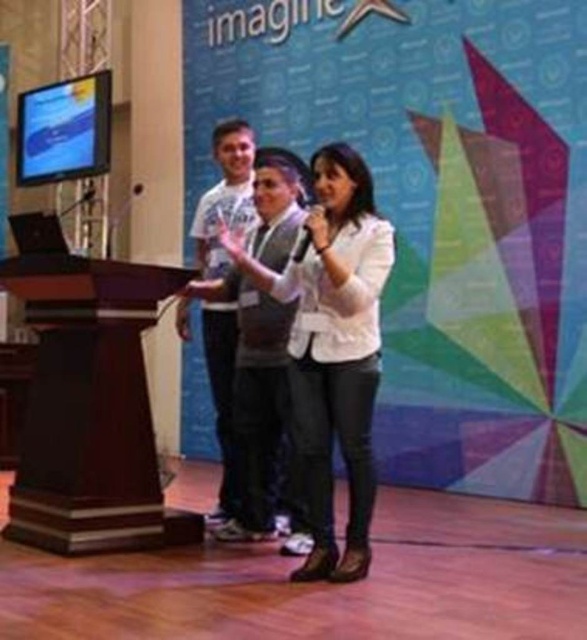
You are standing on the stage and want to move from the point at [106,371] to the point at [342,388]. Is the destination point in front of or behind you?

The point at [342,388] is in front of you because the point at [106,371] is behind it.

You are organizing a presentation and need to place a large banner between the dark wood podium at left and the white matte jacket at center. Which object should the banner be placed closer to if it needs to be near the smaller object?

The banner should be placed closer to the dark wood podium at left because it is smaller in size compared to the white matte jacket at center.